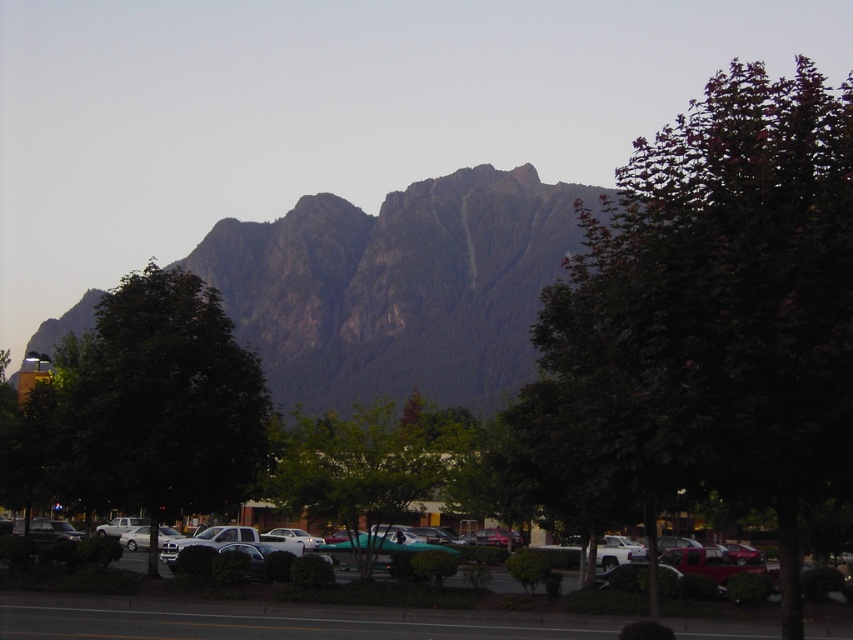
Question: Does metallic gray cars at center have a lesser width compared to green leafy tree at center?

Choices:
 (A) yes
 (B) no

Answer: (B)

Question: Considering the real-world distances, which object is closest to the green leafy tree at left?

Choices:
 (A) rocky gray mountain range at upper center
 (B) green leafy tree at upper right
 (C) green leafy tree at center
 (D) metallic gray cars at center

Answer: (C)

Question: Is rocky gray mountain range at upper center wider than green leafy tree at left?

Choices:
 (A) yes
 (B) no

Answer: (A)

Question: Can you confirm if rocky gray mountain range at upper center is thinner than green leafy tree at left?

Choices:
 (A) yes
 (B) no

Answer: (B)

Question: Which object is the closest to the metallic gray cars at center?

Choices:
 (A) green leafy tree at center
 (B) green leafy tree at left
 (C) rocky gray mountain range at upper center
 (D) green leafy tree at upper right

Answer: (B)

Question: Which object appears farthest from the camera in this image?

Choices:
 (A) rocky gray mountain range at upper center
 (B) green leafy tree at center

Answer: (A)